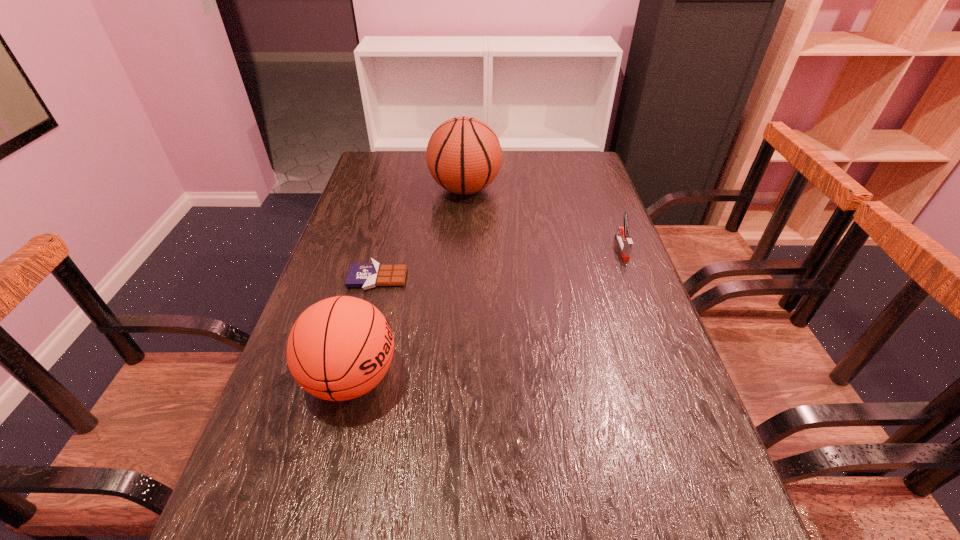
Locate an element on the screen. The height and width of the screenshot is (540, 960). free space located on the handle side of the third tallest object is located at coordinates (656, 335).

Image resolution: width=960 pixels, height=540 pixels. Identify the location of free spot located 0.270m on the front of the third farthest object. (349, 387).

Image resolution: width=960 pixels, height=540 pixels. In order to click on object present at the far edge in this screenshot , I will do (463, 155).

Image resolution: width=960 pixels, height=540 pixels. Identify the location of basketball that is at the left edge. (340, 348).

Locate an element on the screen. chocolate bar situated at the left edge is located at coordinates (367, 276).

Locate an element on the screen. object present at the right edge is located at coordinates point(625,243).

In the image, there is a desktop. Find the location of `vacant space at the far edge`. vacant space at the far edge is located at coordinates (517, 152).

In the image, there is a desktop. Identify the location of vacant space at the left edge. Image resolution: width=960 pixels, height=540 pixels. (307, 444).

In the image, there is a desktop. Identify the location of vacant area at the right edge. The height and width of the screenshot is (540, 960). point(661,357).

The height and width of the screenshot is (540, 960). I want to click on free region at the far left corner, so click(x=396, y=158).